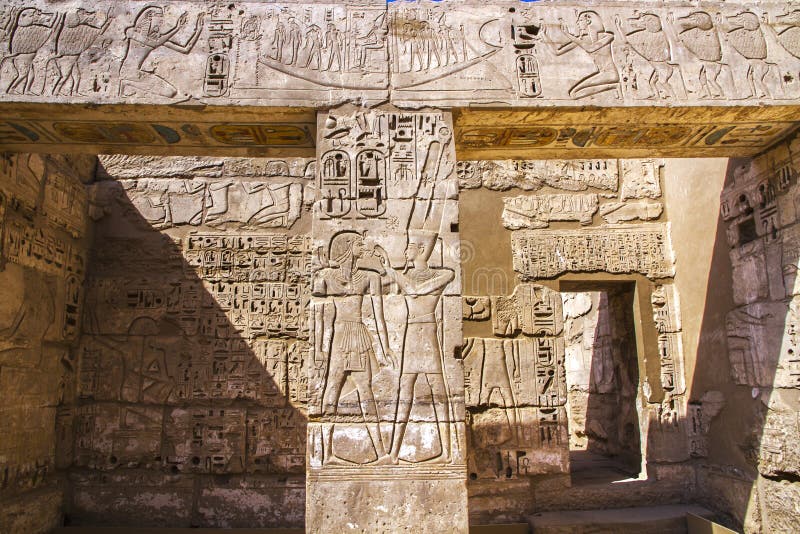
Image resolution: width=800 pixels, height=534 pixels. What are the coordinates of `chest` in the screenshot? It's located at (422, 305).